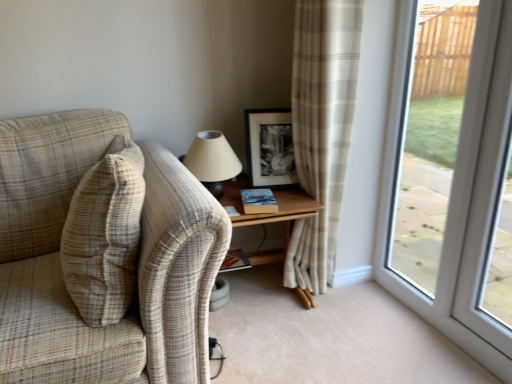
The height and width of the screenshot is (384, 512). I want to click on blank area beneath hardcover book at center, which is the first book from top to bottom (from a real-world perspective), so click(x=264, y=200).